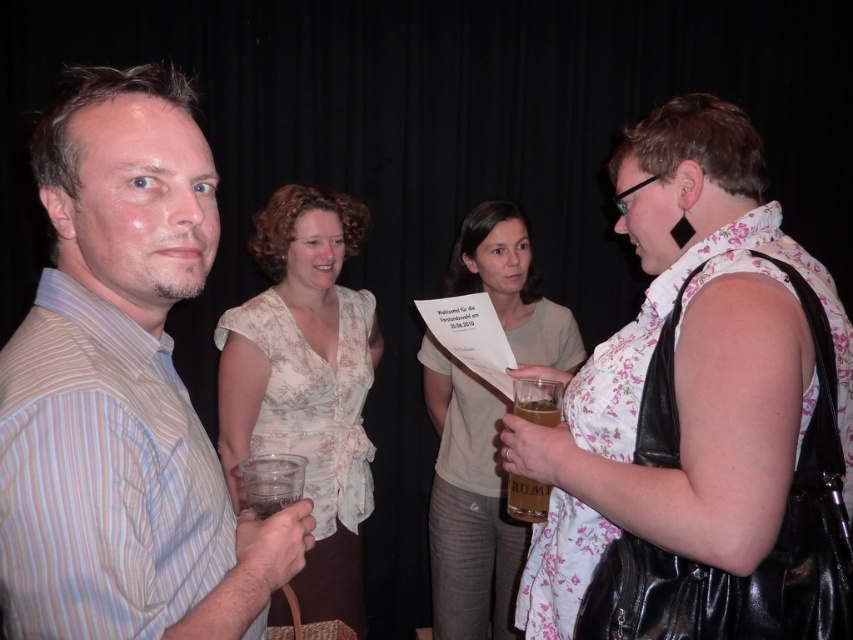
What do you see at coordinates (468, 504) in the screenshot?
I see `white paper at center` at bounding box center [468, 504].

Does white paper at center have a larger size compared to translucent plastic cup at lower center?

Indeed, white paper at center has a larger size compared to translucent plastic cup at lower center.

Locate an element on the screen. The height and width of the screenshot is (640, 853). white paper at center is located at coordinates (468, 504).

Which is behind, point (682, 305) or point (431, 376)?

The point (431, 376) is behind.

Does floral fabric dress at center have a smaller size compared to white paper at center?

No, floral fabric dress at center is not smaller than white paper at center.

Is point (679, 372) in front of point (485, 444)?

Yes, it is in front of point (485, 444).

The height and width of the screenshot is (640, 853). In order to click on floral fabric dress at center in this screenshot , I will do `click(699, 417)`.

Does striped cotton shirt at left have a larger size compared to white paper at center?

No, striped cotton shirt at left is not bigger than white paper at center.

Which is below, striped cotton shirt at left or white paper at center?

white paper at center is below.

At what (x,y) coordinates should I click in order to perform the action: click on striped cotton shirt at left. Please return your answer as a coordinate pair (x, y). The height and width of the screenshot is (640, 853). Looking at the image, I should click on (122, 388).